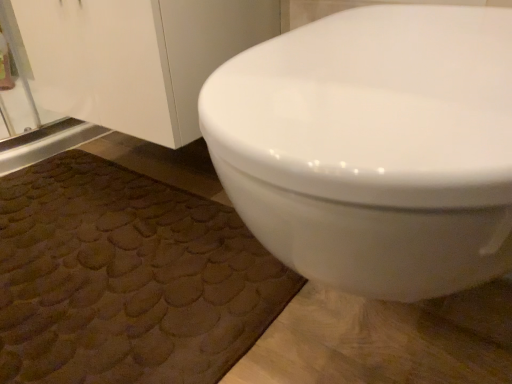
Locate an element on the screen. This screenshot has height=384, width=512. free point above brown textured bath mat at lower left (from a real-world perspective) is located at coordinates coord(101,234).